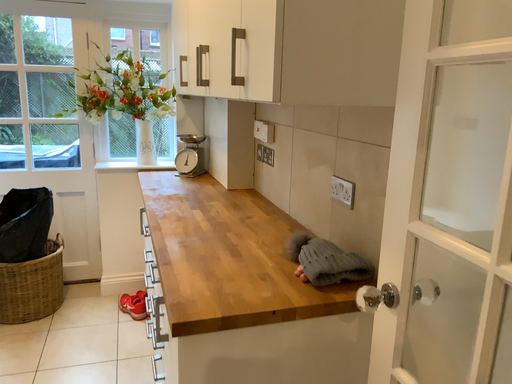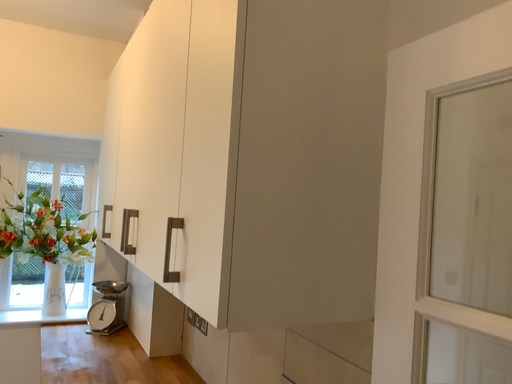
Question: How did the camera likely rotate when shooting the video?

Choices:
 (A) rotated right
 (B) rotated left

Answer: (A)